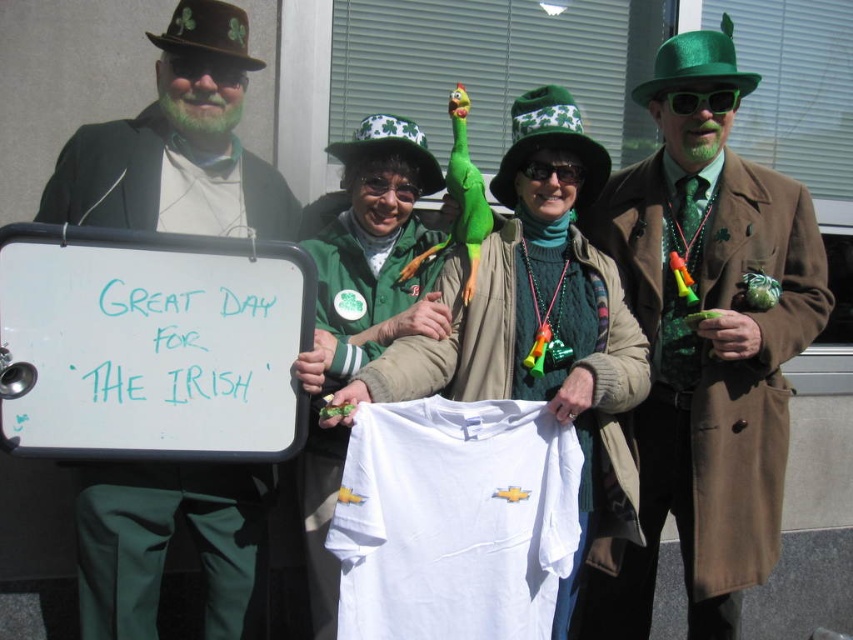
Question: Which object appears closest to the camera in this image?

Choices:
 (A) green fabric shirt at center
 (B) white cotton t-shirt at center
 (C) matte green suit at left
 (D) green felt hat at upper right

Answer: (B)

Question: Is green felt hat at upper right above green fabric shirt at center?

Choices:
 (A) no
 (B) yes

Answer: (B)

Question: Is matte green suit at left positioned in front of green fabric shirt at center?

Choices:
 (A) no
 (B) yes

Answer: (A)

Question: Does matte green suit at left come behind green fabric shirt at center?

Choices:
 (A) no
 (B) yes

Answer: (B)

Question: Which point is farther to the camera?

Choices:
 (A) (410, 216)
 (B) (786, 321)

Answer: (A)

Question: Which object is farther from the camera taking this photo?

Choices:
 (A) green fabric shirt at center
 (B) white cotton t-shirt at center
 (C) green felt hat at upper right

Answer: (C)